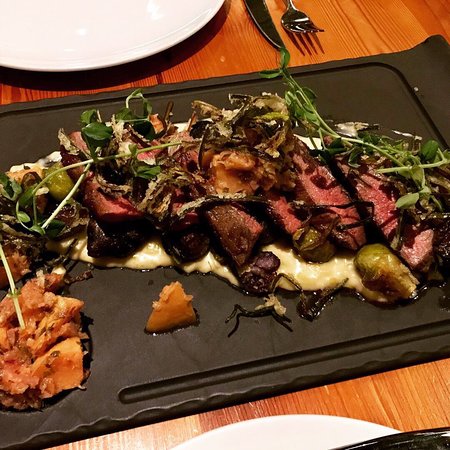
You are a GUI agent. You are given a task and a screenshot of the screen. Output one action in this format:
    pyautogui.click(x=<x>, y=<y>)
    Task: Click on the wooden table above tray
    The height and width of the screenshot is (450, 450).
    Given the screenshot: What is the action you would take?
    pyautogui.click(x=358, y=35)